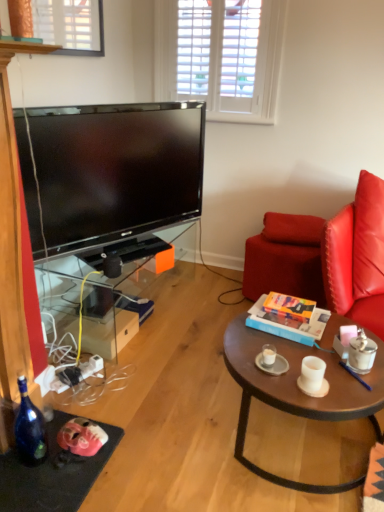
Identify the location of free space that is to the left of matte gray saucer at center. Image resolution: width=384 pixels, height=512 pixels. (243, 361).